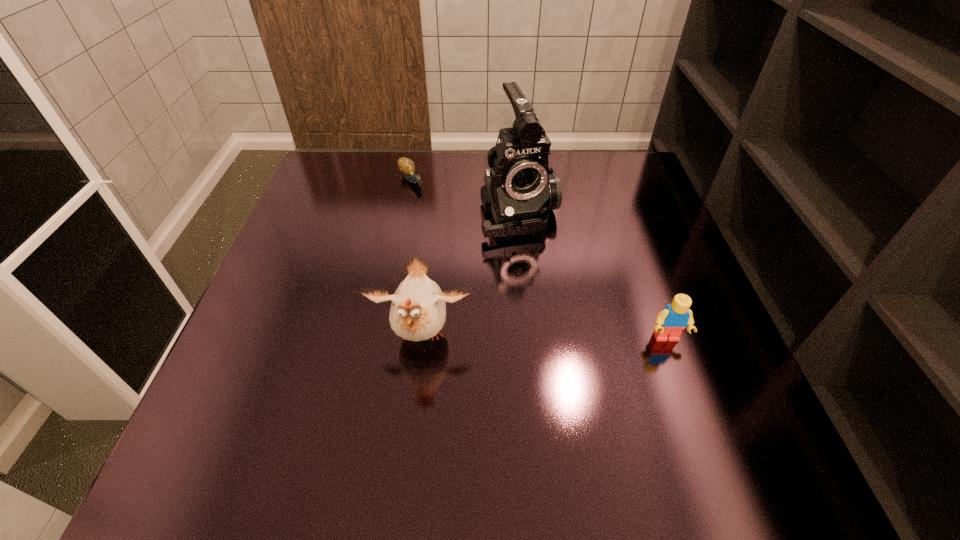
Where is `free space on the desktop that is between the bird and the rightmost object and is positioned on the front-facing side of the escargot`? The image size is (960, 540). free space on the desktop that is between the bird and the rightmost object and is positioned on the front-facing side of the escargot is located at coordinates (553, 338).

The width and height of the screenshot is (960, 540). Identify the location of vacant space on the desktop that is between the bird and the third tallest object and is positioned on the lens mount of the camcorder. (573, 338).